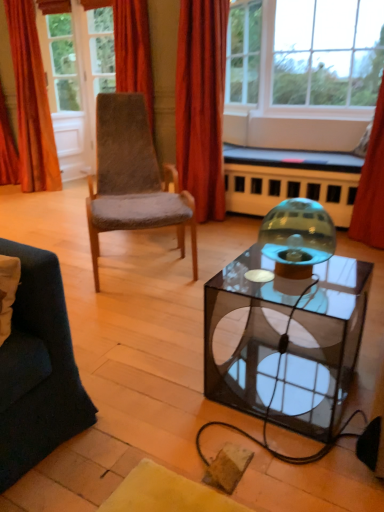
Locate an element on the screen. The height and width of the screenshot is (512, 384). free region under transparent glass table at center (from a real-world perspective) is located at coordinates (284, 383).